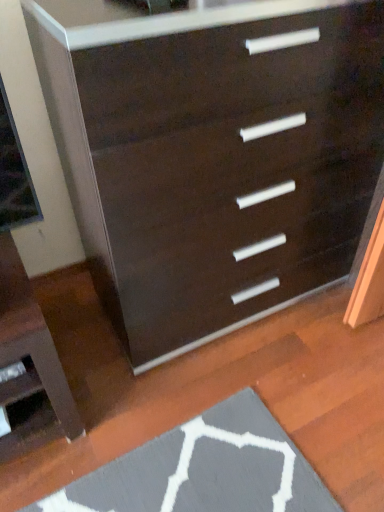
Find the location of a particular element. The width and height of the screenshot is (384, 512). free space in front of matte black dresser at center is located at coordinates (224, 415).